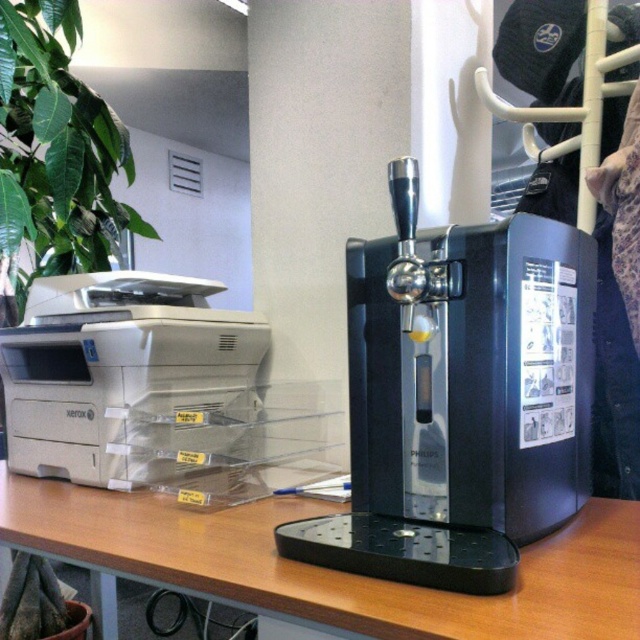
Question: Which object appears closest to the camera in this image?

Choices:
 (A) matte gray printer at left
 (B) brown wood table at center
 (C) black plastic coffee machine at center

Answer: (B)

Question: Can you confirm if black plastic coffee machine at center is positioned above matte gray printer at left?

Choices:
 (A) yes
 (B) no

Answer: (A)

Question: Which point is closer to the camera?

Choices:
 (A) brown wood table at center
 (B) green leafy plant at upper left
 (C) matte gray printer at left

Answer: (A)

Question: Among these objects, which one is nearest to the camera?

Choices:
 (A) brown wood table at center
 (B) black plastic coffee machine at center
 (C) matte gray printer at left

Answer: (A)

Question: Can you confirm if brown wood table at center is positioned above green leafy plant at upper left?

Choices:
 (A) no
 (B) yes

Answer: (A)

Question: Is brown wood table at center positioned behind green leafy plant at upper left?

Choices:
 (A) no
 (B) yes

Answer: (A)